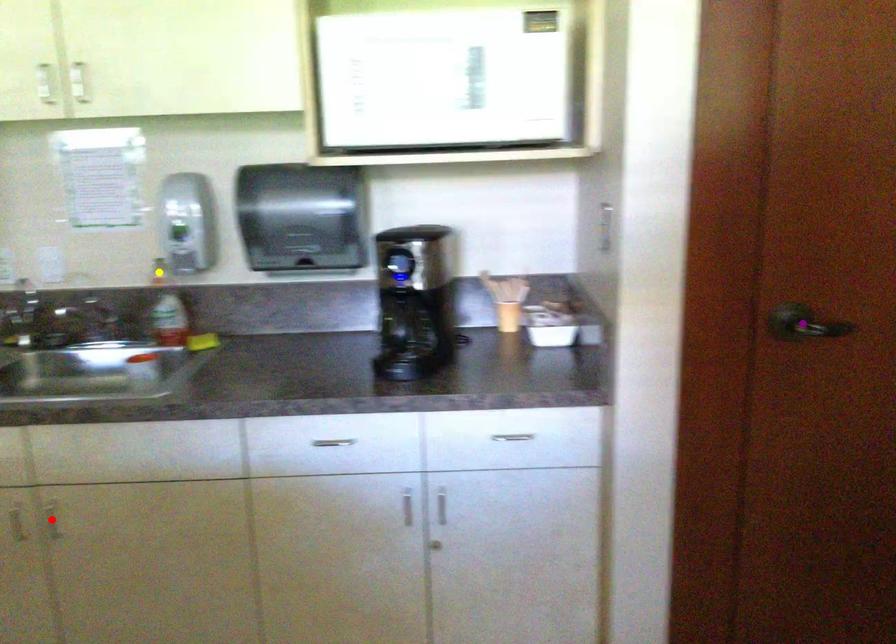
Order these from nearest to farthest:
purple point | red point | yellow point

1. purple point
2. red point
3. yellow point